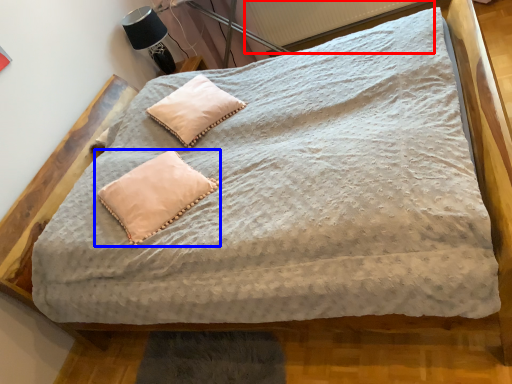
Question: Which of the following is the closest to the observer, radiator (highlighted by a red box) or pillow (highlighted by a blue box)?

Choices:
 (A) radiator
 (B) pillow

Answer: (B)